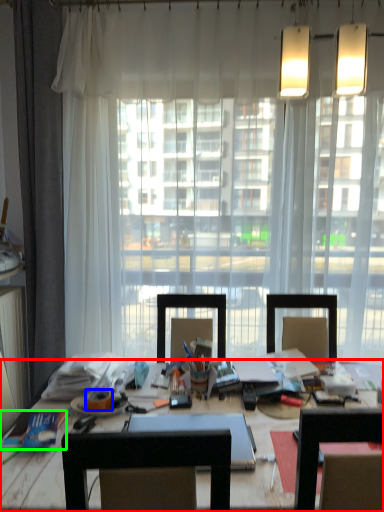
Question: Based on their relative distances, which object is farther from desk (highlighted by a red box)? Choose from adhesive tape (highlighted by a blue box) and book (highlighted by a green box).

Choices:
 (A) adhesive tape
 (B) book

Answer: (A)